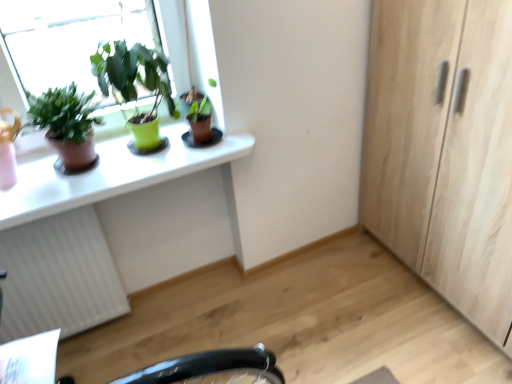
Locate an element on the screen. vacant space to the right of matte brown pot at upper left, arranged as the 3th houseplant when viewed from the right is located at coordinates (146, 168).